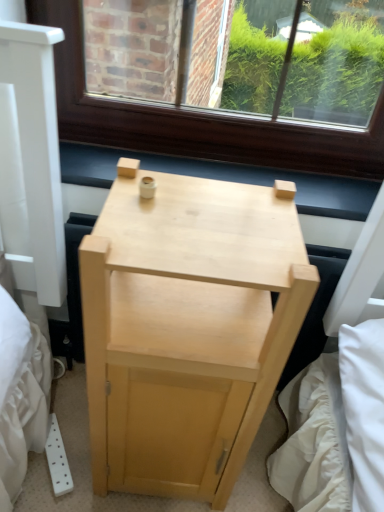
Locate an element on the screen. vacant space situated above light wood at center (from a real-world perspective) is located at coordinates (211, 177).